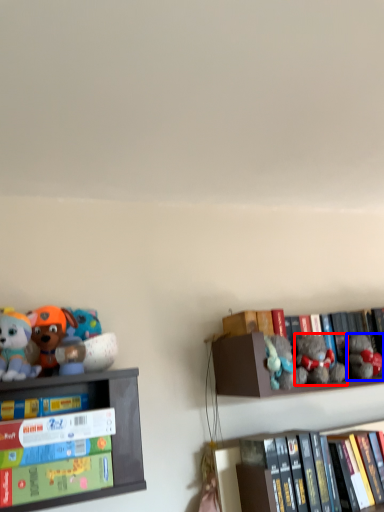
Question: Which point is closer to the camera, toy (highlighted by a red box) or toy (highlighted by a blue box)?

Choices:
 (A) toy
 (B) toy

Answer: (A)